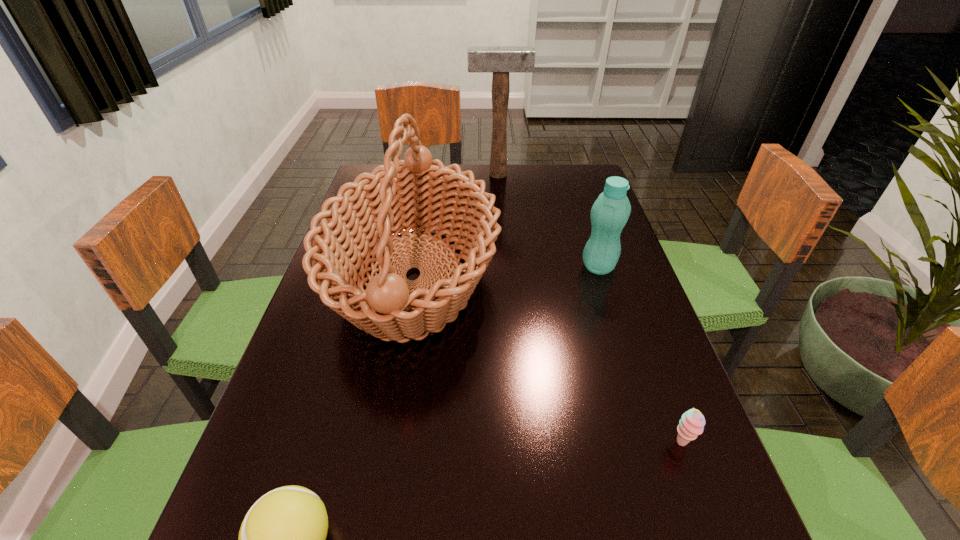
This screenshot has height=540, width=960. In order to click on free space between the farthest object and the sherbert in this screenshot , I will do tap(589, 309).

Locate an element on the screen. This screenshot has height=540, width=960. free space that is in between the farthest object and the shortest object is located at coordinates (589, 309).

Locate an element on the screen. The image size is (960, 540). object that is the fourth closest one to the mallet is located at coordinates (282, 539).

I want to click on object that is the third closest to the basket, so click(x=282, y=539).